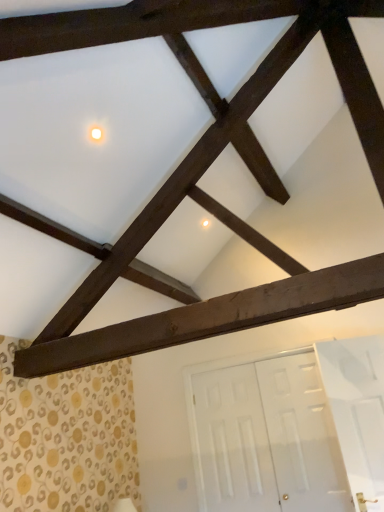
What do you see at coordinates (96, 134) in the screenshot? I see `white glossy light at upper center` at bounding box center [96, 134].

What are the coordinates of `white glossy door at lower right` in the screenshot? It's located at (265, 437).

Locate an element on the screen. This screenshot has width=384, height=512. white glossy light at upper center is located at coordinates (96, 134).

In the scene shown: Which is more to the right, white glossy light at upper center or white glossy door at lower right?

Positioned to the right is white glossy door at lower right.

Consider the image. Which of these two, white glossy light at upper center or white glossy door at lower right, stands taller?

white glossy door at lower right is taller.

From a real-world perspective, which is physically above, white glossy light at upper center or white glossy door at lower right?

white glossy light at upper center is physically above.

Considering the relative sizes of white glossy light at upper center and dark brown wood at center in the image provided, is white glossy light at upper center thinner than dark brown wood at center?

Correct, the width of white glossy light at upper center is less than that of dark brown wood at center.

Can you tell me how much white glossy light at upper center and dark brown wood at center differ in facing direction?

87.3 degrees separate the facing orientations of white glossy light at upper center and dark brown wood at center.

Which object is more forward, white glossy light at upper center or dark brown wood at center?

dark brown wood at center.

Considering the sizes of objects white glossy light at upper center and dark brown wood at center in the image provided, who is shorter, white glossy light at upper center or dark brown wood at center?

With less height is white glossy light at upper center.

Would you say white glossy door at lower right contains white glossy light at upper center?

Actually, white glossy light at upper center is outside white glossy door at lower right.

Is white glossy door at lower right in front of or behind white glossy light at upper center in the image?

white glossy door at lower right is behind white glossy light at upper center.

Which point is more distant from viewer, (x=258, y=361) or (x=101, y=132)?

The point (x=258, y=361) is farther.

Which of these two, white glossy door at lower right or white glossy light at upper center, is smaller?

Smaller between the two is white glossy light at upper center.

Locate an element on the screen. plank on the left of white glossy door at lower right is located at coordinates point(210,318).

Considering the sizes of objects dark brown wood at center and white glossy door at lower right in the image provided, who is thinner, dark brown wood at center or white glossy door at lower right?

With smaller width is white glossy door at lower right.

Considering the sizes of objects dark brown wood at center and white glossy door at lower right in the image provided, who is shorter, dark brown wood at center or white glossy door at lower right?

With less height is dark brown wood at center.

How far apart are dark brown wood at center and white glossy door at lower right?

The distance of dark brown wood at center from white glossy door at lower right is 4.65 feet.

Looking at the image, does white glossy door at lower right seem bigger or smaller compared to dark brown wood at center?

In the image, white glossy door at lower right appears to be larger than dark brown wood at center.

From the image's perspective, is white glossy door at lower right located above dark brown wood at center?

No, from the image's perspective, white glossy door at lower right is not above dark brown wood at center.

Is white glossy door at lower right facing away from dark brown wood at center?

No, white glossy door at lower right's orientation is not away from dark brown wood at center.

From a real-world perspective, is white glossy door at lower right physically below dark brown wood at center?

Yes.

Based on the photo, does dark brown wood at center have a greater width compared to white glossy light at upper center?

Indeed, dark brown wood at center has a greater width compared to white glossy light at upper center.

In the scene shown: In the image, is dark brown wood at center positioned in front of or behind white glossy light at upper center?

dark brown wood at center is positioned closer to the viewer than white glossy light at upper center.

From the image's perspective, which is above, dark brown wood at center or white glossy light at upper center?

white glossy light at upper center.

Does dark brown wood at center turn towards white glossy light at upper center?

No.

Identify the location of door behind the white glossy light at upper center. The image size is (384, 512). (265, 437).

Where is `plank lying below the white glossy light at upper center (from the image's perspective)`? The height and width of the screenshot is (512, 384). plank lying below the white glossy light at upper center (from the image's perspective) is located at coordinates [210, 318].

Which object lies nearer to the anchor point white glossy light at upper center, white glossy door at lower right or dark brown wood at center?

The object closer to white glossy light at upper center is dark brown wood at center.

Considering their positions, is dark brown wood at center positioned closer to white glossy door at lower right than white glossy light at upper center?

dark brown wood at center.

From the image, which object appears to be farther from dark brown wood at center, white glossy door at lower right or white glossy light at upper center?

white glossy door at lower right is further to dark brown wood at center.

Based on their spatial positions, is white glossy light at upper center or dark brown wood at center closer to white glossy door at lower right?

dark brown wood at center lies closer to white glossy door at lower right than the other object.

From the image, which object appears to be farther from dark brown wood at center, white glossy light at upper center or white glossy door at lower right?

white glossy door at lower right.

From the image, which object appears to be nearer to white glossy light at upper center, dark brown wood at center or white glossy door at lower right?

dark brown wood at center is closer to white glossy light at upper center.

This screenshot has width=384, height=512. I want to click on plank between white glossy light at upper center and white glossy door at lower right vertically, so pos(210,318).